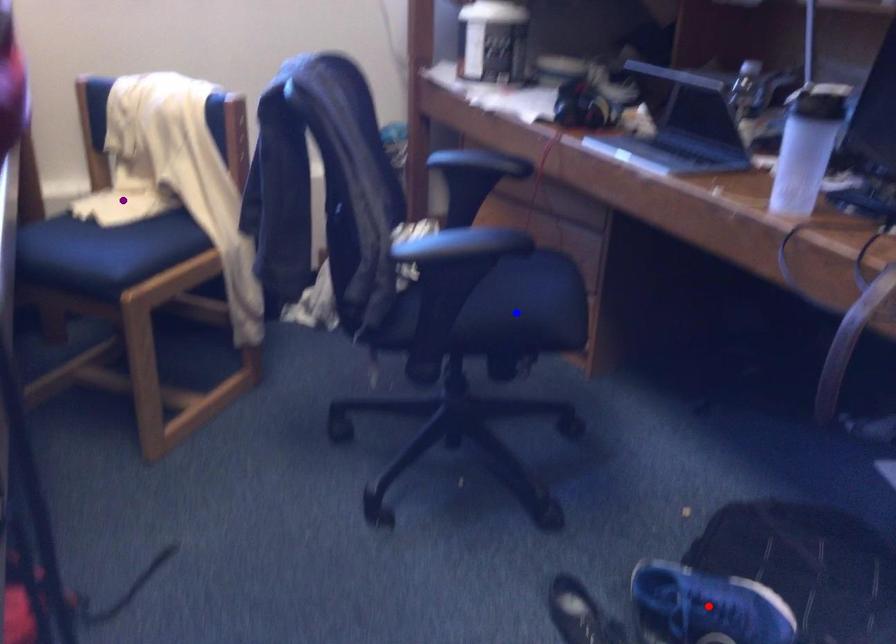
Order these from nearest to farthest:
purple point
red point
blue point

1. red point
2. blue point
3. purple point